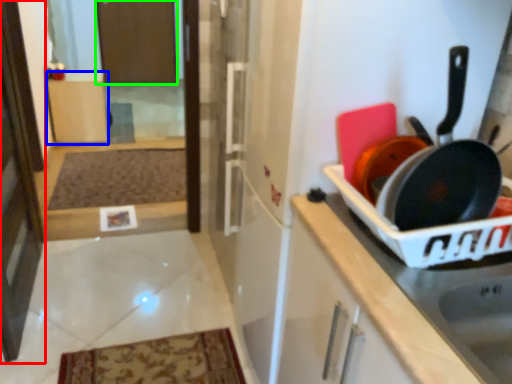
Question: Considering the real-world distances, which object is closest to screen door (highlighted by a red box)? cabinetry (highlighted by a blue box) or screen door (highlighted by a green box).

Choices:
 (A) cabinetry
 (B) screen door

Answer: (A)